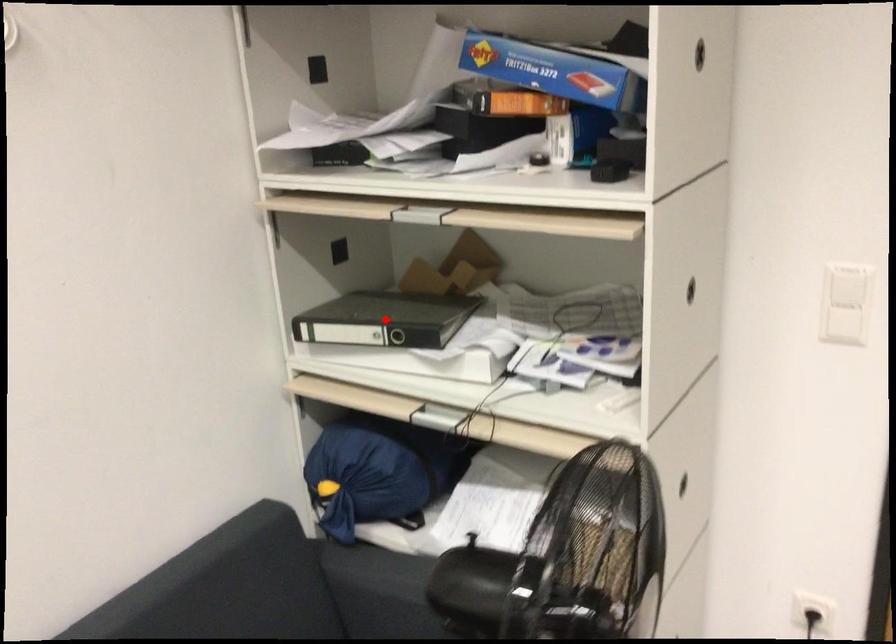
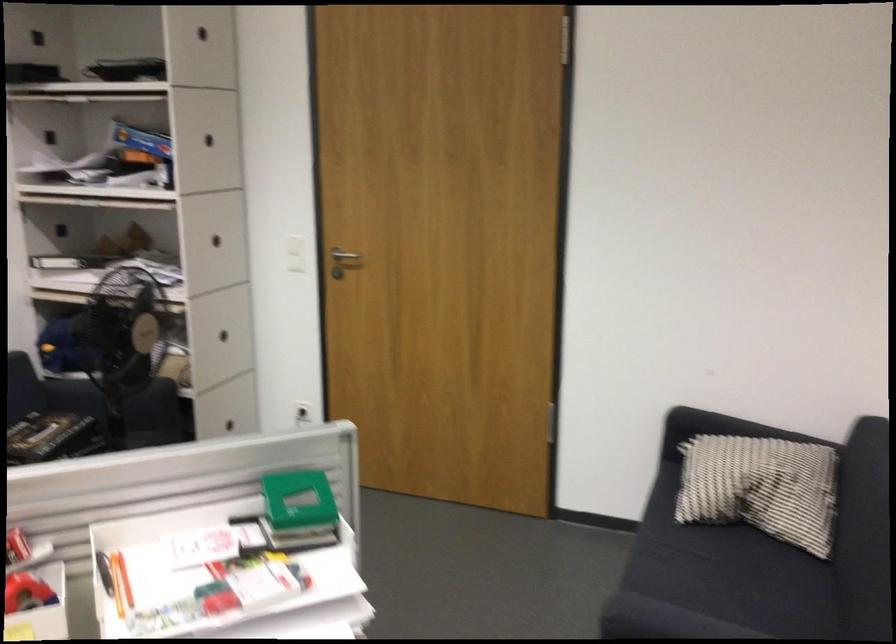
Question: I am providing you with two images of the same scene from different viewpoints. In image1, a red point is highlighted. Considering the same 3D point in image2, which of the following is correct?

Choices:
 (A) It is closer
 (B) It is farther

Answer: (B)